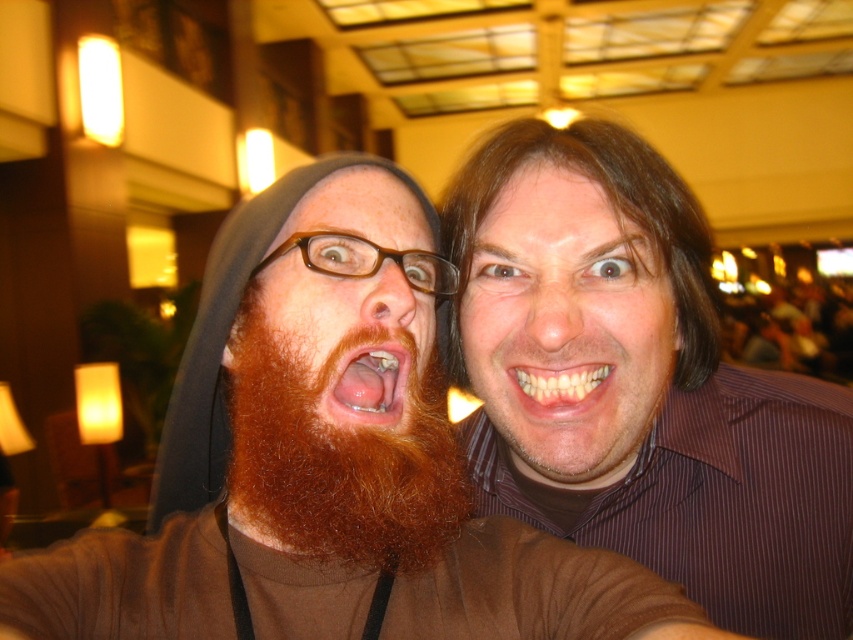
Which of these two, brown striped shirt at center or pink flesh at center, stands taller?

With more height is brown striped shirt at center.

Can you confirm if brown striped shirt at center is bigger than pink flesh at center?

Indeed, brown striped shirt at center has a larger size compared to pink flesh at center.

Which is in front, point (537, 260) or point (405, 412)?

Point (405, 412) is in front.

I want to click on brown striped shirt at center, so click(x=640, y=385).

Can you confirm if brownmaterial/textureshirt at center is bigger than brown matte beard at center?

Yes, brownmaterial/textureshirt at center is bigger than brown matte beard at center.

Can you confirm if brownmaterial/textureshirt at center is positioned to the left of brown matte beard at center?

Incorrect, brownmaterial/textureshirt at center is not on the left side of brown matte beard at center.

Identify the location of brownmaterial/textureshirt at center. The height and width of the screenshot is (640, 853). (387, 460).

Locate an element on the screen. The height and width of the screenshot is (640, 853). brownmaterial/textureshirt at center is located at coordinates (387, 460).

Does brown matte beard at center have a larger size compared to yellowish matte teeth at center?

Yes.

Who is higher up, brown matte beard at center or yellowish matte teeth at center?

brown matte beard at center is higher up.

Which is in front, point (433, 314) or point (544, 387)?

Point (433, 314) is more forward.

This screenshot has width=853, height=640. In order to click on brown matte beard at center in this screenshot , I will do `click(352, 300)`.